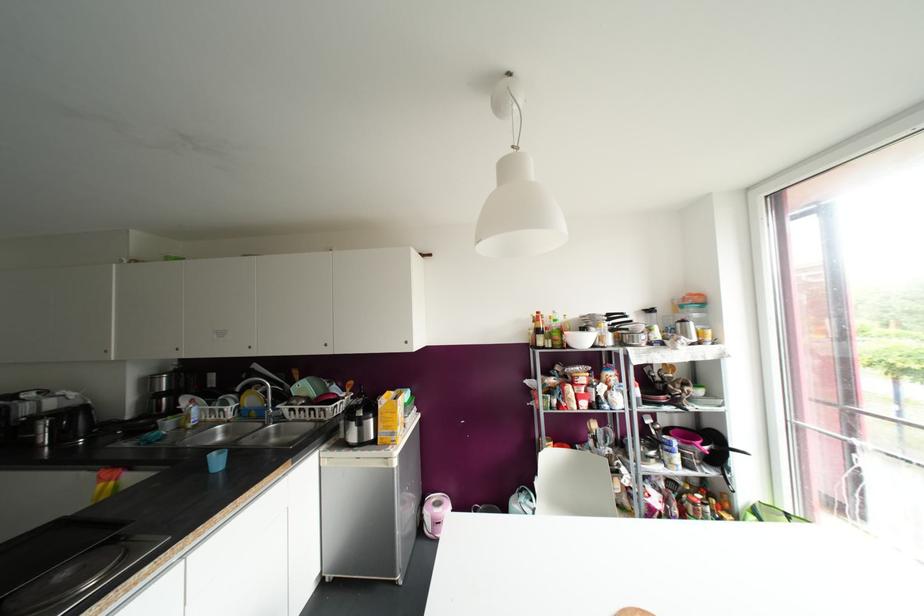
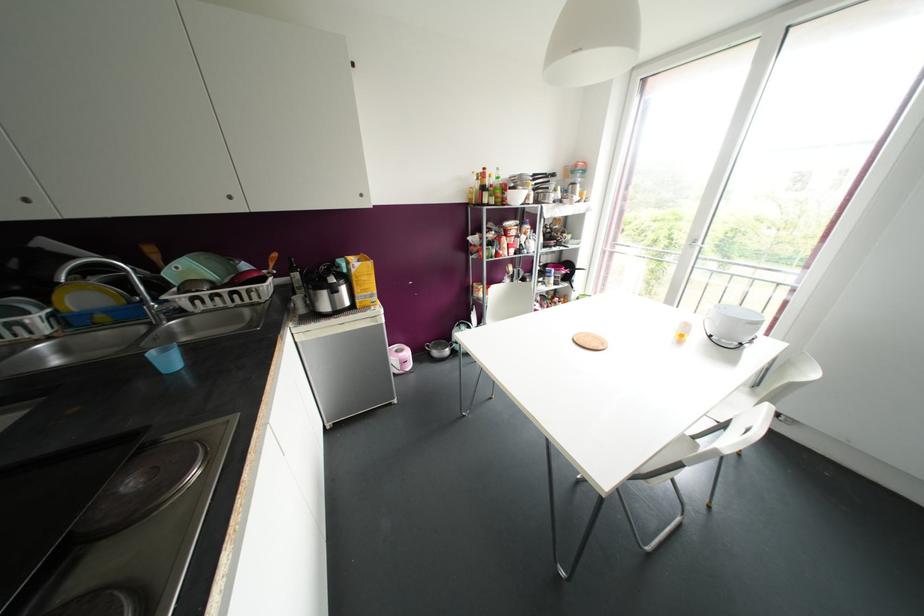
In the second image, find the point that corresponds to point 278,418 in the first image.

(178, 312)